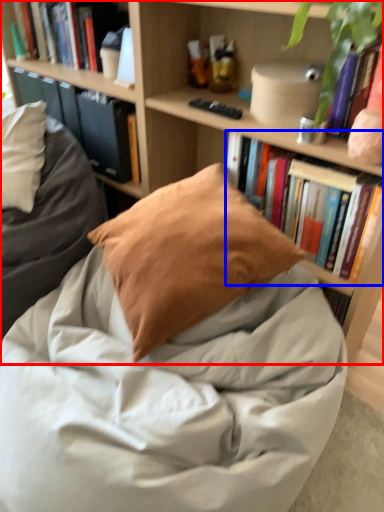
Question: Which point is closer to the camera, bookcase (highlighted by a red box) or book (highlighted by a blue box)?

Choices:
 (A) bookcase
 (B) book

Answer: (A)